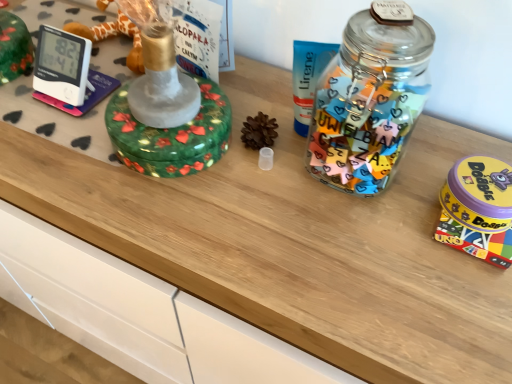
Identify the location of vacant space situated on the left part of transparent plastic pinecone at center, arranged as the second toy when viewed from the right. The image size is (512, 384). (143, 172).